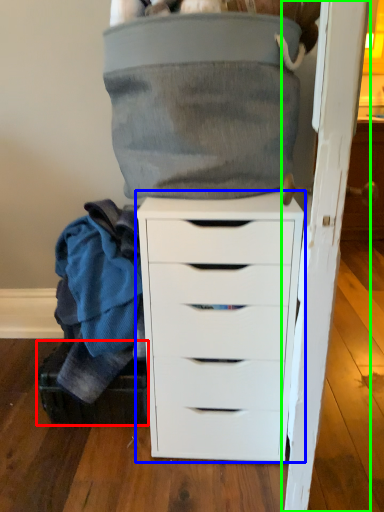
Question: Which object is the closest to the shoe box (highlighted by a red box)? Choose among these: chest of drawers (highlighted by a blue box) or door (highlighted by a green box).

Choices:
 (A) chest of drawers
 (B) door

Answer: (A)